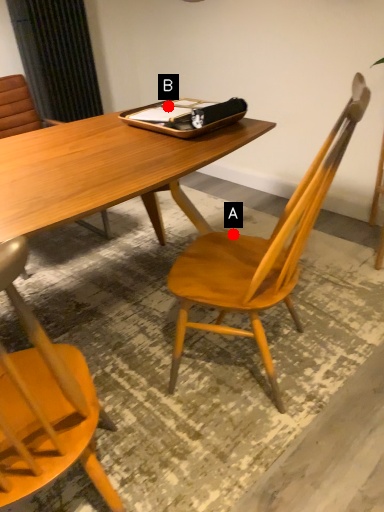
Question: Two points are circled on the image, labeled by A and B beside each circle. Which point appears closest to the camera in this image?

Choices:
 (A) A is closer
 (B) B is closer

Answer: (A)